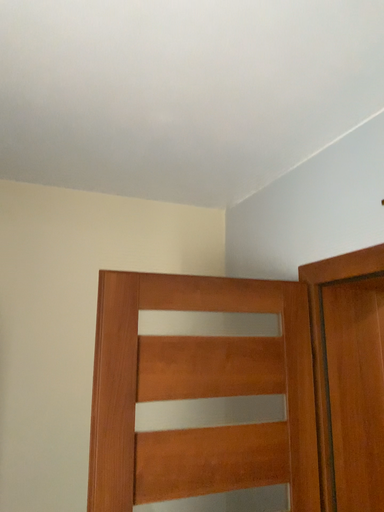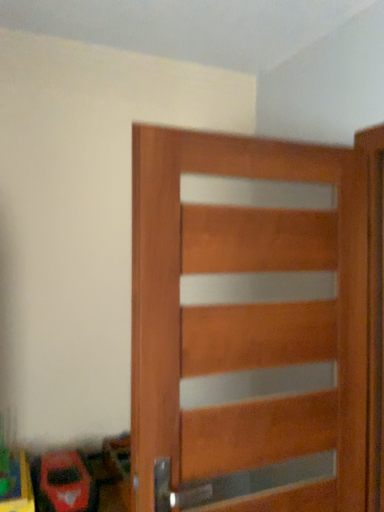
Question: Which way did the camera rotate in the video?

Choices:
 (A) rotated upward
 (B) rotated downward

Answer: (B)